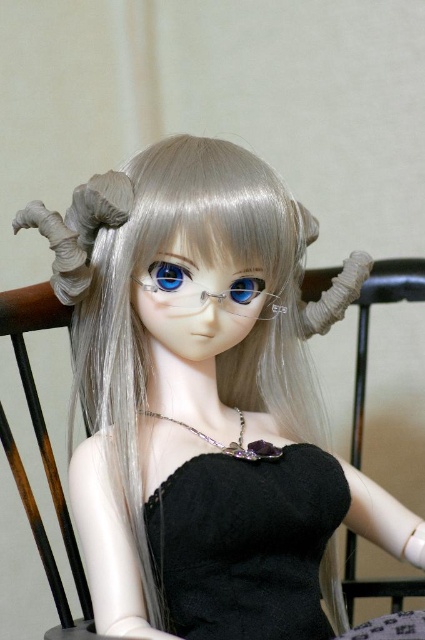
Question: Which point is farther to the camera?

Choices:
 (A) (263, 280)
 (B) (210, 604)
 (C) (158, 260)

Answer: (A)

Question: Can you confirm if black velvet dress at center is thinner than blue glass eye at center?

Choices:
 (A) no
 (B) yes

Answer: (A)

Question: Which is farther from the black velvet dress at center?

Choices:
 (A) blue glossy eye at center
 (B) blue glass eye at center

Answer: (A)

Question: Can you confirm if black velvet dress at center is positioned above blue glossy eye at center?

Choices:
 (A) no
 (B) yes

Answer: (A)

Question: Can you confirm if blue glossy eye at center is positioned below blue glass eye at center?

Choices:
 (A) yes
 (B) no

Answer: (B)

Question: Which of the following is the farthest from the observer?

Choices:
 (A) (175, 280)
 (B) (243, 298)
 (C) (303, 541)

Answer: (B)